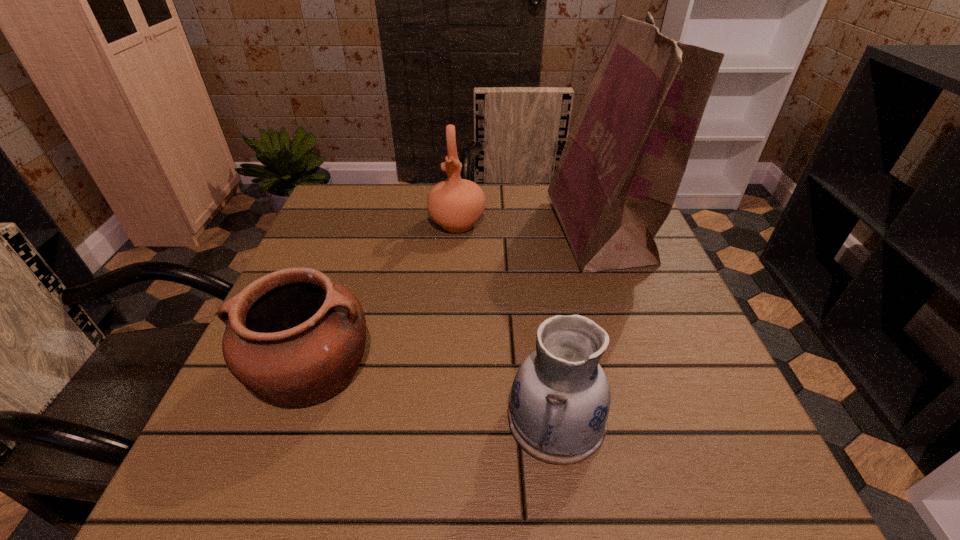
This screenshot has height=540, width=960. What are the coordinates of `vacant region located 0.090m on the spout of the third object from right to left` in the screenshot? It's located at (454, 264).

Locate an element on the screen. This screenshot has height=540, width=960. vacant area located on the back of the rightmost pottery is located at coordinates (544, 329).

This screenshot has height=540, width=960. I want to click on vacant space situated 0.050m on the back of the leftmost pottery, so click(x=334, y=303).

This screenshot has height=540, width=960. Find the location of `grocery bag situated at the far edge`. grocery bag situated at the far edge is located at coordinates (617, 178).

The image size is (960, 540). Find the location of `pottery present at the far edge`. pottery present at the far edge is located at coordinates (456, 204).

Where is `object that is at the near edge`? object that is at the near edge is located at coordinates (560, 399).

You are a GUI agent. You are given a task and a screenshot of the screen. Output one action in this format:
    pyautogui.click(x=<x>, y=<y>)
    Task: Click on the object at the left edge
    The image size is (960, 540).
    Given the screenshot: What is the action you would take?
    pyautogui.click(x=294, y=337)

Find the location of a particular element. The width and height of the screenshot is (960, 540). object located at the right edge is located at coordinates (617, 178).

Identify the location of object that is at the far right corner. This screenshot has height=540, width=960. (617, 178).

You are a GUI agent. You are given a task and a screenshot of the screen. Output one action in this format:
    pyautogui.click(x=<x>, y=<y>)
    Task: Click on the vacant space at the far edge of the desktop
    Image resolution: width=960 pixels, height=540 pixels.
    Given the screenshot: What is the action you would take?
    click(549, 204)